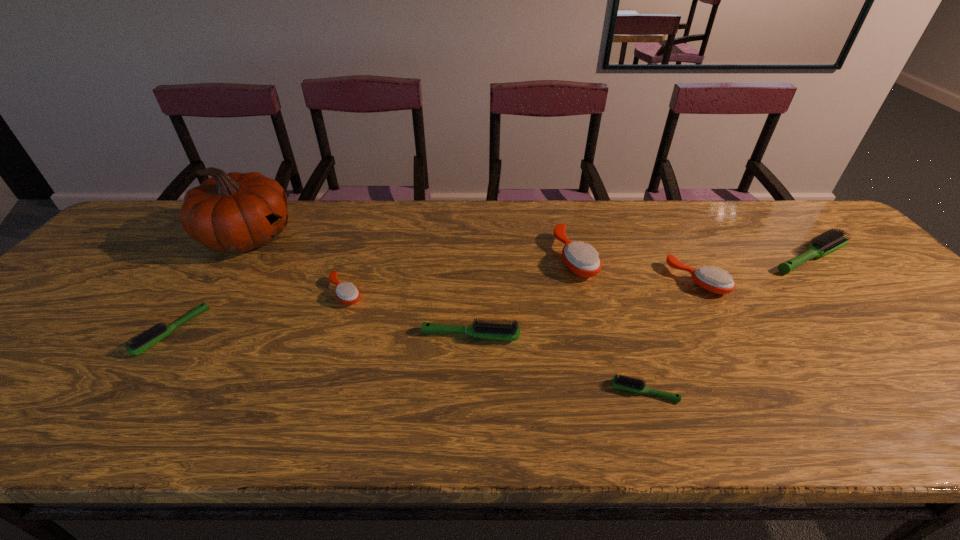
Find the location of a particular element. Image resolution: width=960 pixels, height=540 pixels. free space between the biggest orange hairbrush and the sixth hairbrush from left to right is located at coordinates (636, 269).

Identify the location of free space between the biggest orange hairbrush and the tallest object. (412, 247).

Find the location of a particular element. unoccupied position between the third biggest light hairbrush and the nearest light hairbrush is located at coordinates (408, 361).

This screenshot has height=540, width=960. I want to click on object that is the fifth closest to the second smallest orange hairbrush, so click(x=347, y=293).

Locate an element on the screen. The height and width of the screenshot is (540, 960). object that stands as the second closest to the leftmost orange hairbrush is located at coordinates (510, 332).

Identify which hairbrush is the second nearest to the second smallest orange hairbrush. Please provide its 2D coordinates. Your answer should be formatted as a tuple, i.e. [(x, y)], where the tuple contains the x and y coordinates of a point satisfying the conditions above.

[(582, 259)]

The width and height of the screenshot is (960, 540). I want to click on hairbrush object that ranks as the closest to the biggest orange hairbrush, so click(x=713, y=280).

Select which orange hairbrush is the second closest to the fourth object from left to right. Please provide its 2D coordinates. Your answer should be formatted as a tuple, i.e. [(x, y)], where the tuple contains the x and y coordinates of a point satisfying the conditions above.

[(582, 259)]

Choose which orange hairbrush is the nearest neighbor to the shortest object. Please provide its 2D coordinates. Your answer should be formatted as a tuple, i.e. [(x, y)], where the tuple contains the x and y coordinates of a point satisfying the conditions above.

[(713, 280)]

Identify which light hairbrush is located as the nearest to the second orange hairbrush from left to right. Please provide its 2D coordinates. Your answer should be formatted as a tuple, i.e. [(x, y)], where the tuple contains the x and y coordinates of a point satisfying the conditions above.

[(510, 332)]